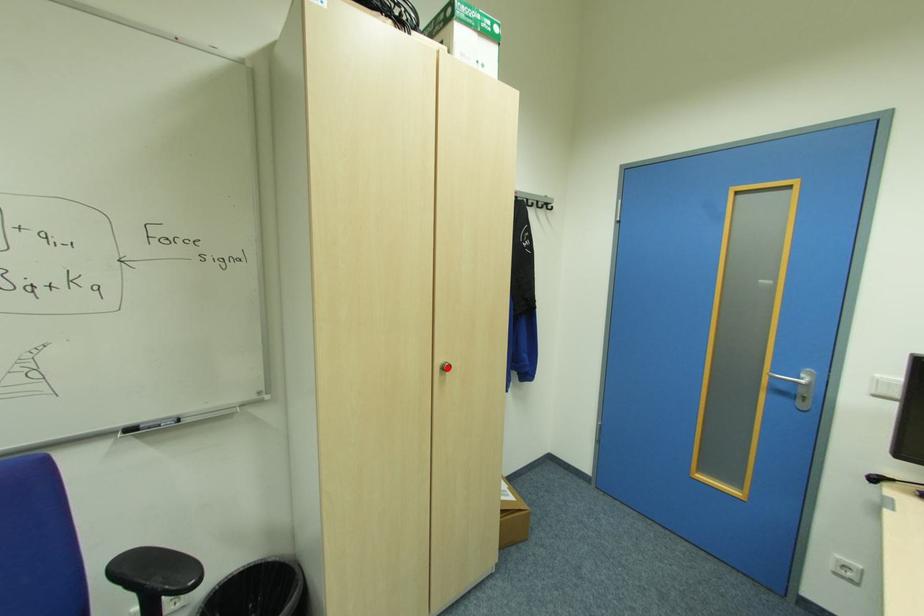
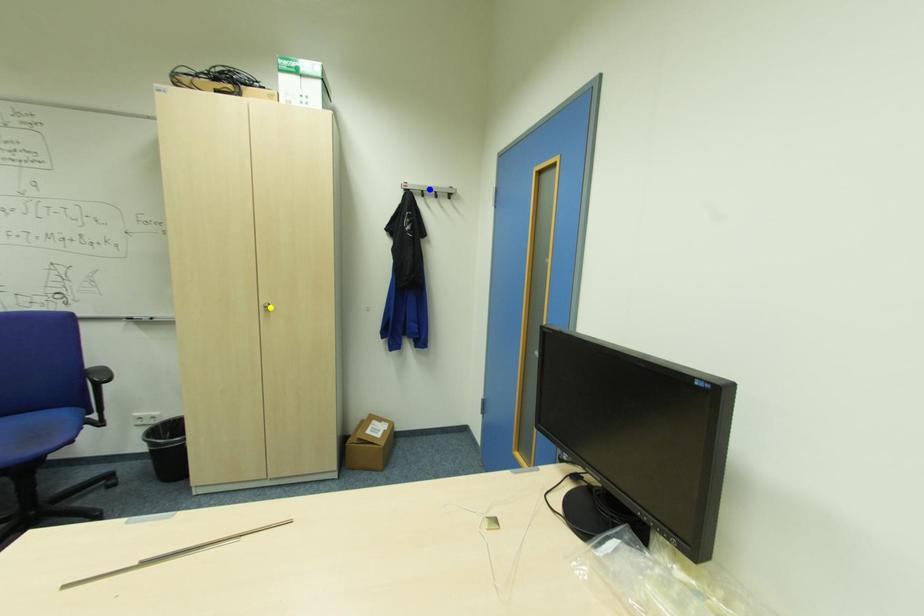
Question: I am providing you with two images of the same scene from different viewpoints. A red point is marked on the first image. You are given multiple points on the second image. Which spot in image 2 lines up with the point in image 1?

Choices:
 (A) yellow point
 (B) green point
 (C) blue point

Answer: (A)